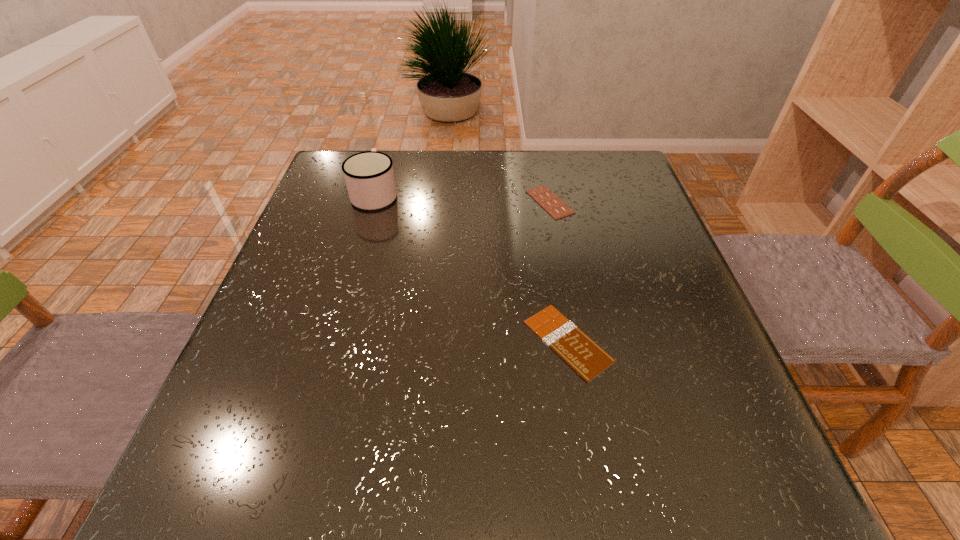
Find the location of `unoccupied area between the taller chocolate bar and the nearest object`. unoccupied area between the taller chocolate bar and the nearest object is located at coordinates (559, 272).

At what (x,y) coordinates should I click in order to perform the action: click on vacant point located between the farther chocolate bar and the nearer chocolate bar. Please return your answer as a coordinate pair (x, y). The height and width of the screenshot is (540, 960). Looking at the image, I should click on (559, 272).

Image resolution: width=960 pixels, height=540 pixels. I want to click on vacant point located between the second shortest object and the leftmost object, so click(x=463, y=198).

You are a GUI agent. You are given a task and a screenshot of the screen. Output one action in this format:
    pyautogui.click(x=<x>, y=<y>)
    Task: Click on the unoccupied position between the shortest object and the second shortest object
    This screenshot has width=960, height=540.
    Given the screenshot: What is the action you would take?
    pyautogui.click(x=559, y=272)

Locate an element on the screen. The image size is (960, 540). vacant space that's between the shorter chocolate bar and the mug is located at coordinates (471, 267).

At what (x,y) coordinates should I click in order to perform the action: click on free space that is in between the nearest object and the leftmost object. Please return your answer as a coordinate pair (x, y). The width and height of the screenshot is (960, 540). Looking at the image, I should click on click(471, 267).

At what (x,y) coordinates should I click in order to perform the action: click on unoccupied position between the tallest object and the nearer chocolate bar. Please return your answer as a coordinate pair (x, y). The height and width of the screenshot is (540, 960). Looking at the image, I should click on pos(471,267).

Where is `free space between the second shortest object and the nearest object`? Image resolution: width=960 pixels, height=540 pixels. free space between the second shortest object and the nearest object is located at coordinates (559, 272).

This screenshot has height=540, width=960. Identify the location of the closest object to the taller chocolate bar. (568, 341).

Image resolution: width=960 pixels, height=540 pixels. What are the coordinates of `object that is the second closest to the farther chocolate bar` in the screenshot? It's located at (369, 176).